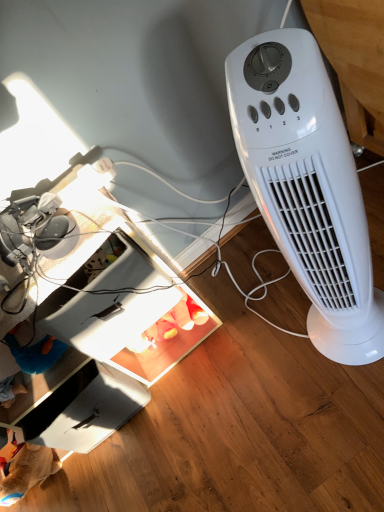
You are a GUI agent. You are given a task and a screenshot of the screen. Output one action in this format:
    pyautogui.click(x=<x>, y=<y>)
    Task: Click on the free space behind white plastic heater at right
    Image resolution: width=384 pixels, height=512 pixels.
    Given the screenshot: What is the action you would take?
    pyautogui.click(x=276, y=295)